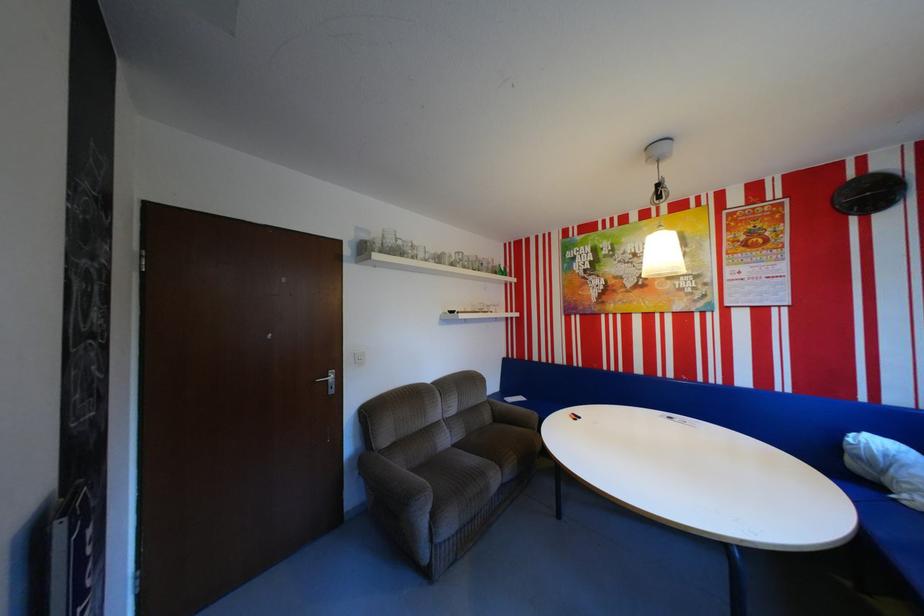
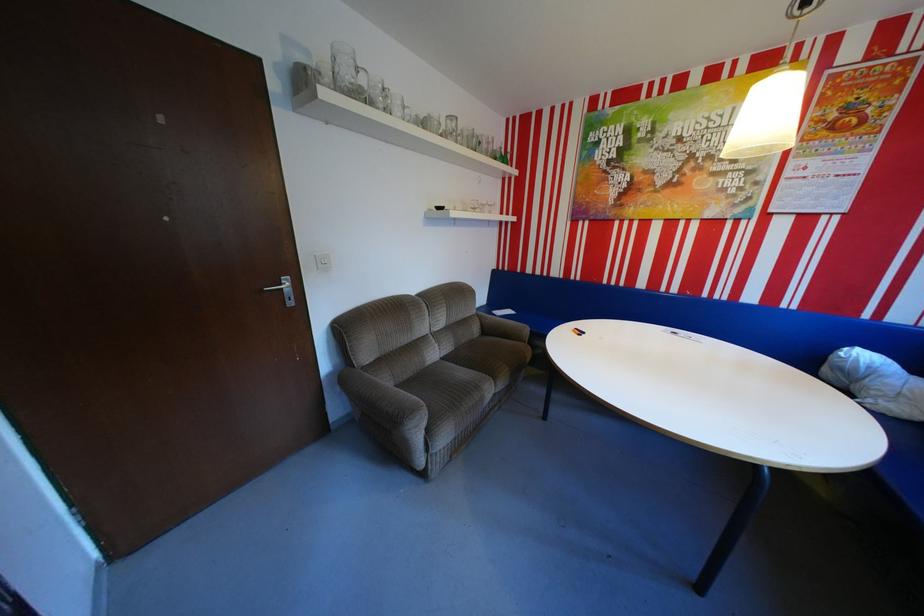
In the second image, find the point that corresponds to (x=402, y=240) in the first image.

(359, 73)